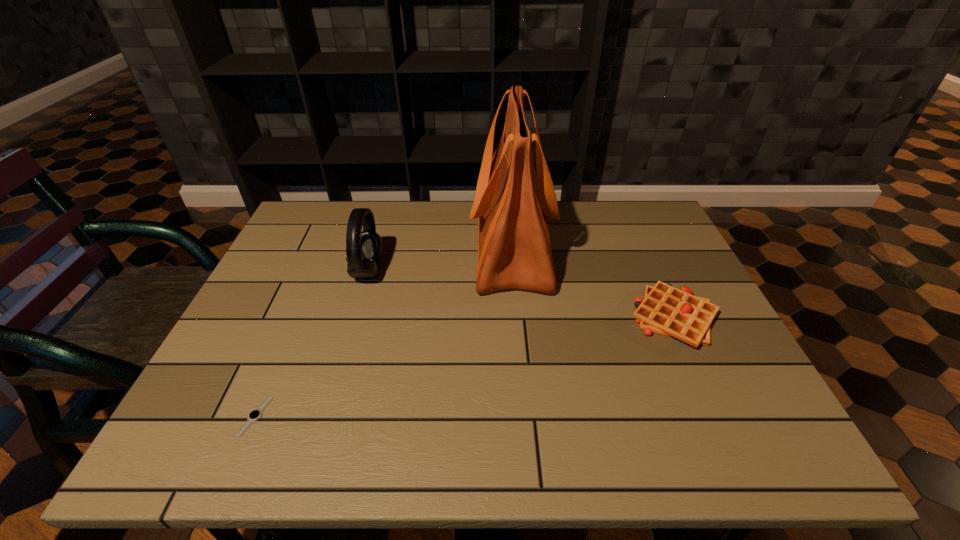
This screenshot has height=540, width=960. I want to click on free space that satisfies the following two spatial constraints: 1. on the front pocket of the tallest object; 2. on the left side of the rightmost object, so click(x=517, y=318).

I want to click on free location that satisfies the following two spatial constraints: 1. on the earcups of the headset; 2. on the front side of the shortest object, so click(x=325, y=416).

I want to click on free location that satisfies the following two spatial constraints: 1. on the back side of the rightmost object; 2. on the earcups of the third object from right to left, so click(x=652, y=271).